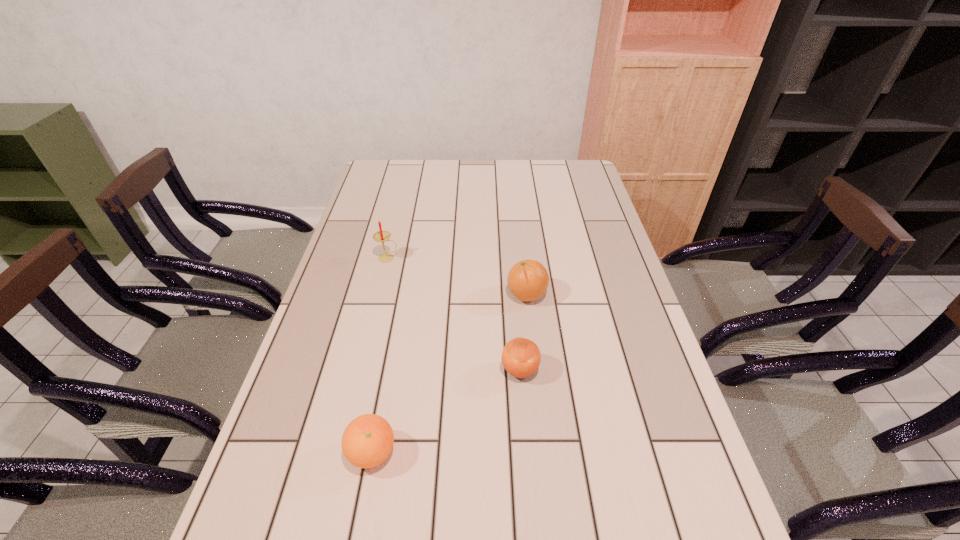
Find the location of a particular element. object that is at the left edge is located at coordinates (381, 236).

The width and height of the screenshot is (960, 540). In the image, there is a desktop. In order to click on vacant space at the far edge in this screenshot , I will do `click(518, 165)`.

Where is `vacant space at the left edge`? The image size is (960, 540). vacant space at the left edge is located at coordinates (336, 297).

This screenshot has width=960, height=540. Identify the location of free region at the right edge of the desktop. (631, 326).

Find the location of a particular element. This screenshot has height=540, width=960. vacant area at the far right corner of the desktop is located at coordinates (573, 185).

The height and width of the screenshot is (540, 960). Find the location of `free point between the second nearest orange and the nearest orange`. free point between the second nearest orange and the nearest orange is located at coordinates (445, 411).

Identify the location of empty space that is in between the nearest orange and the third nearest object. (449, 374).

The image size is (960, 540). I want to click on free space between the candle and the second farthest object, so [457, 276].

Where is `free space between the tallest object and the second farthest orange`? free space between the tallest object and the second farthest orange is located at coordinates pos(454,314).

Find the location of a particular element. free space between the leftmost orange and the second farthest object is located at coordinates (449, 374).